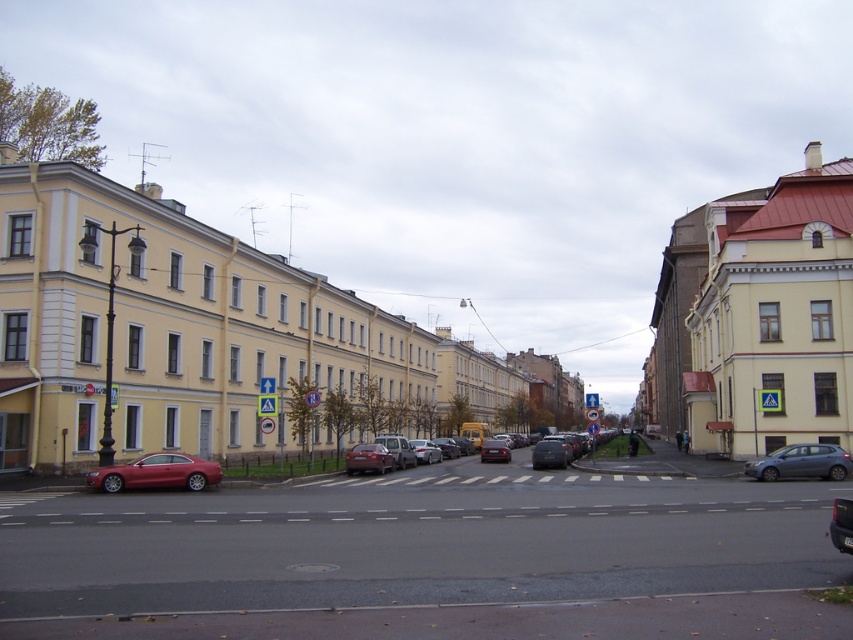
Who is lower down, satin silver sedan at lower right or metallic silver sedan at center?

metallic silver sedan at center is lower down.

Between satin silver sedan at lower right and metallic silver sedan at center, which one has less height?

satin silver sedan at lower right

Locate an element on the screen. The width and height of the screenshot is (853, 640). satin silver sedan at lower right is located at coordinates (801, 461).

At what (x,y) coordinates should I click in order to perform the action: click on satin silver sedan at lower right. Please return your answer as a coordinate pair (x, y). The image size is (853, 640). Looking at the image, I should click on pos(801,461).

Does metallic silver sedan at center have a larger size compared to satin silver sedan at center?

Indeed, metallic silver sedan at center has a larger size compared to satin silver sedan at center.

Which is more to the right, metallic silver sedan at center or satin silver sedan at center?

From the viewer's perspective, satin silver sedan at center appears more on the right side.

Which is in front, point (384, 435) or point (425, 452)?

Positioned in front is point (425, 452).

You are a GUI agent. You are given a task and a screenshot of the screen. Output one action in this format:
    pyautogui.click(x=<x>, y=<y>)
    Task: Click on the metallic silver sedan at center
    This screenshot has height=640, width=853.
    Given the screenshot: What is the action you would take?
    pyautogui.click(x=398, y=449)

Between satin silver sedan at lower right and matte red car at center, which one appears on the left side from the viewer's perspective?

matte red car at center is more to the left.

Which is in front, point (815, 449) or point (643, 472)?

Point (815, 449) is more forward.

What are the coordinates of `satin silver sedan at lower right` in the screenshot? It's located at (801, 461).